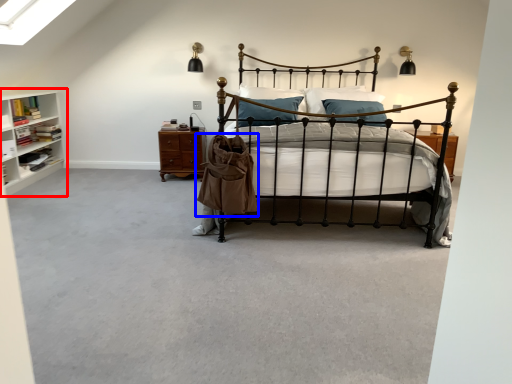
Question: Which of the following is the farthest to the observer, shelf (highlighted by a red box) or trench coat (highlighted by a blue box)?

Choices:
 (A) shelf
 (B) trench coat

Answer: (A)